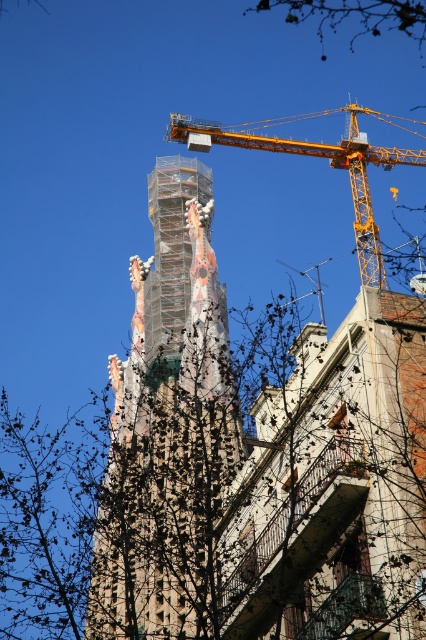
You are an architect standing at the base of the multicolored mosaic tower at center and want to reach the yellow metallic crane at upper center. Given that the crane is 19.70 meters away, can you safely walk directly to it without any obstacles?

The multicolored mosaic tower at center is 19.70 meters from the yellow metallic crane at upper center. Since there are no mentions of obstacles in the scene description, you can safely walk directly to the crane.

You are an architect reviewing the construction site. You notice the multicolored mosaic tower at center and the yellow metallic crane at upper center. Which object takes up more visual space in the image?

The yellow metallic crane at upper center occupies more visual space than the multicolored mosaic tower at center.

You are an architect observing the construction site. You notice the yellow metallic crane at upper center and the bare branches at upper center. Which object is positioned lower in the scene?

The yellow metallic crane at upper center is located below the bare branches at upper center, so it is positioned lower in the scene.